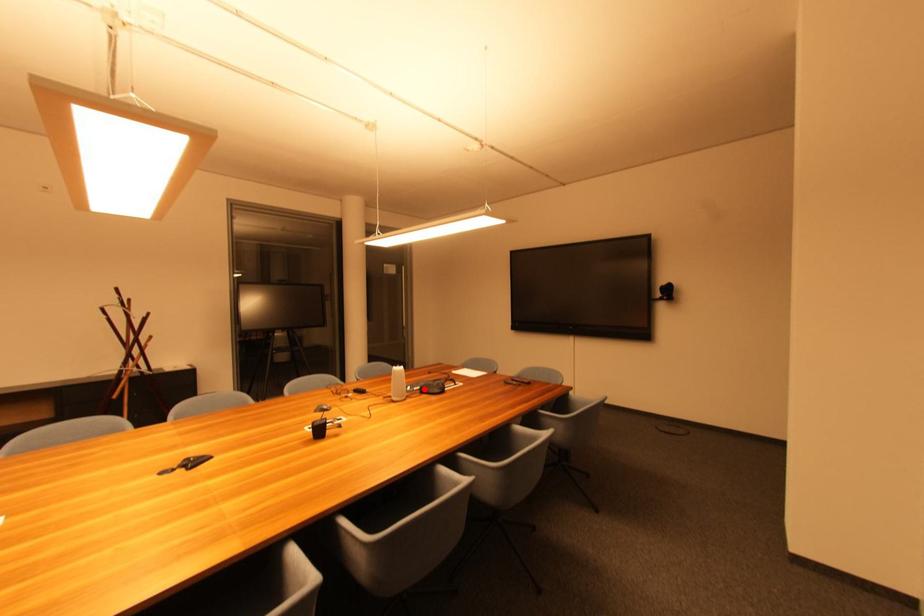
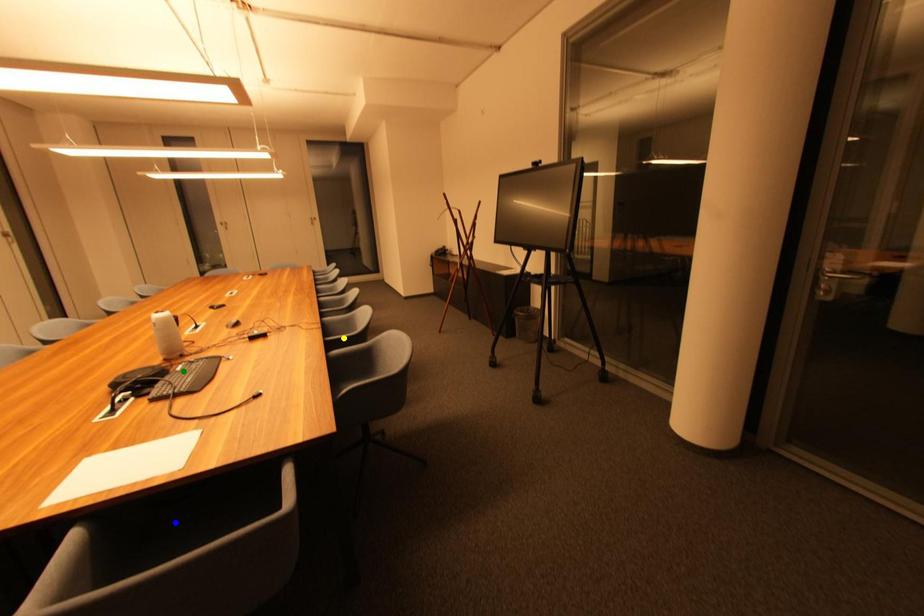
Question: I am providing you with two images of the same scene from different viewpoints. A red point is marked on the first image. You are given multiple points on the second image. Which point in image 2 represents the same 3d spot as the red point in image 1?

Choices:
 (A) blue point
 (B) yellow point
 (C) green point

Answer: (C)